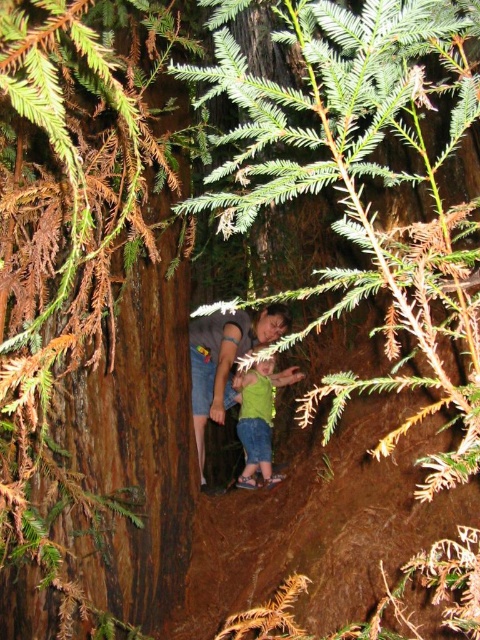
You are planning to take a photo of the brown rough tree trunk at center and the matte gray shirt at center. Which object should you focus on first if you want to capture both in the same frame without moving the camera?

The brown rough tree trunk at center is wider than the matte gray shirt at center, so you should focus on the brown rough tree trunk at center first to ensure it fits in the frame.

From the picture: You are standing in a forest and want to take a photo of the brown rough tree trunk at center. If your camera can focus on objects up to 40 inches away, will it be able to capture the tree trunk clearly?

The brown rough tree trunk at center is 38.21 inches away from the viewer, which is within the camera focus range of up to 40 inches. Therefore, the camera can capture the tree trunk clearly.

You are standing at the entrance of the hollow tree trunk and see two points marked inside the hollow. Which point is closer to you, point (206, 328) or point (240, 474)?

Point (206, 328) is in front of point (240, 474), so it is closer to you.